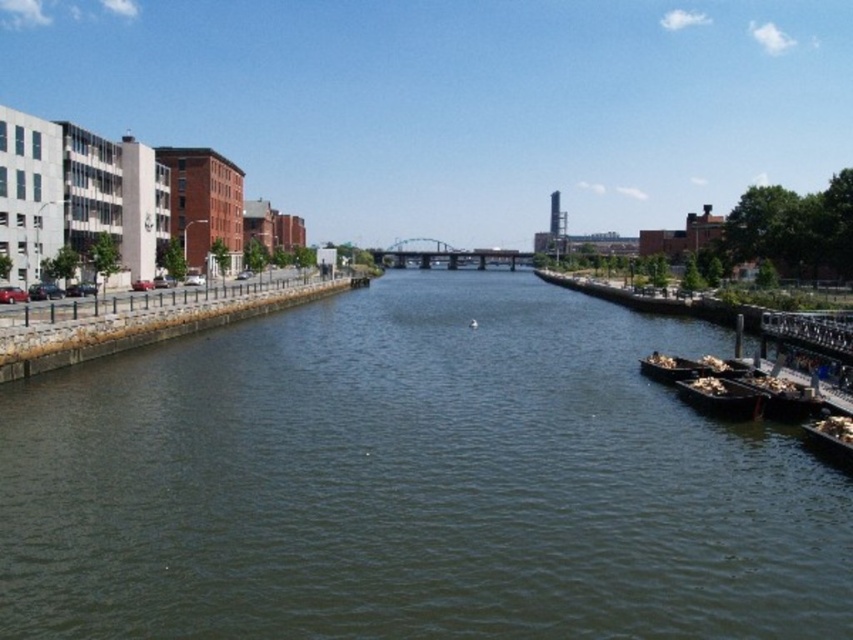
You are a delivery person trying to place a wooden crate on the wooden planks at right next to the wooden boat at right. Can you fit the crate between them if the crate is 1 meter wide?

The wooden planks at right might be wider than wooden boat at right, so there might be enough space to fit the crate between them. However, the exact width difference isn t specified, so it s uncertain.

You are standing at the point marked as point (720,397) in the image. What is the closest object to you in the scene?

The closest object to you is the dark brown wooden boat at lower right because the point is located on it.

You are a boat operator who needs to navigate a small boat from the dock to the river. Based on the scene, can you determine if the dark brown wooden boat at lower right is positioned to the left or right of the dark green water at center?

The dark green water at center is positioned on the left side of dark brown wooden boat at lower right, meaning the dark brown wooden boat at lower right is to the right of the dark green water at center.